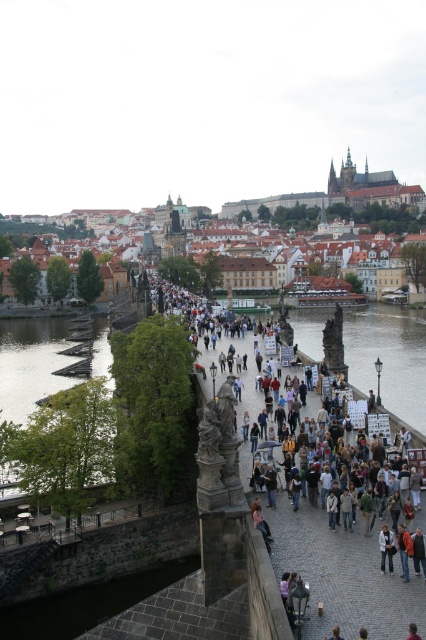
You are a tour guide leading a group on Charles Bridge in Prague. You want to point out the green wood planks at left and the brown stone prague castle at upper center. Which of these two objects is narrower in width?

The green wood planks at left are narrower in width compared to the brown stone prague castle at upper center.

You are standing on the dark stone bridge at center. What is your current 2D coordinate location?

The dark stone bridge at center is located at 2D coordinate point (342, 573).

Looking at this image, you are standing on Charles Bridge and notice two distinct areas of the Vltava River below. The clear water at center and the dark gray stone waterway at lower left. Which one is positioned to the right side of the other?

The clear water at center is to the right of the dark gray stone waterway at lower left.